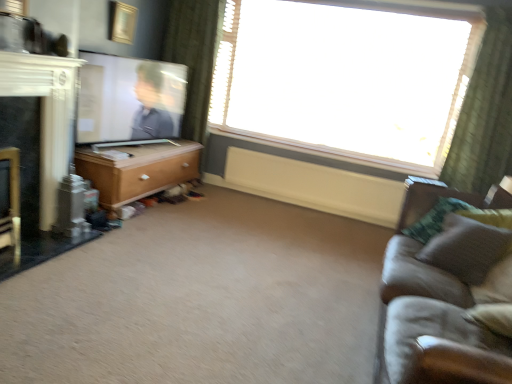
Question: Would you say suede gray couch at right is outside wooden chest of drawers at left?

Choices:
 (A) yes
 (B) no

Answer: (A)

Question: Considering the relative sizes of suede gray couch at right and wooden chest of drawers at left in the image provided, is suede gray couch at right taller than wooden chest of drawers at left?

Choices:
 (A) no
 (B) yes

Answer: (B)

Question: Can you confirm if suede gray couch at right is shorter than wooden chest of drawers at left?

Choices:
 (A) yes
 (B) no

Answer: (B)

Question: Can you confirm if suede gray couch at right is thinner than wooden chest of drawers at left?

Choices:
 (A) yes
 (B) no

Answer: (B)

Question: Can you confirm if suede gray couch at right is smaller than wooden chest of drawers at left?

Choices:
 (A) no
 (B) yes

Answer: (A)

Question: Considering their positions, is green textured curtain at upper right located in front of or behind carpet at center?

Choices:
 (A) behind
 (B) front

Answer: (A)

Question: In terms of height, does green textured curtain at upper right look taller or shorter compared to carpet at center?

Choices:
 (A) tall
 (B) short

Answer: (A)

Question: From the image's perspective, is green textured curtain at upper right above or below carpet at center?

Choices:
 (A) above
 (B) below

Answer: (A)

Question: Would you say green textured curtain at upper right is inside or outside carpet at center?

Choices:
 (A) outside
 (B) inside

Answer: (A)

Question: From a real-world perspective, relative to matte white tv at left, is black glossy fireplace at left vertically above or below?

Choices:
 (A) below
 (B) above

Answer: (A)

Question: Is black glossy fireplace at left in front of or behind matte white tv at left in the image?

Choices:
 (A) behind
 (B) front

Answer: (B)

Question: Choose the correct answer: Is black glossy fireplace at left inside matte white tv at left or outside it?

Choices:
 (A) outside
 (B) inside

Answer: (A)

Question: Is point (35, 97) closer or farther from the camera than point (106, 61)?

Choices:
 (A) closer
 (B) farther

Answer: (A)

Question: Which is correct: green textured curtain at upper right is inside matte white tv at left, or outside of it?

Choices:
 (A) outside
 (B) inside

Answer: (A)

Question: Looking at the image, does green textured curtain at upper right seem bigger or smaller compared to matte white tv at left?

Choices:
 (A) big
 (B) small

Answer: (A)